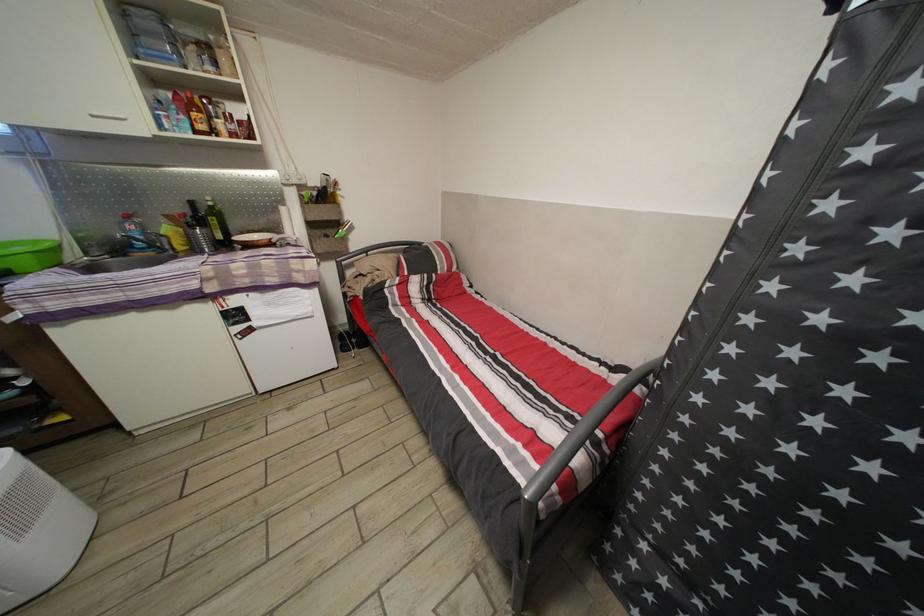
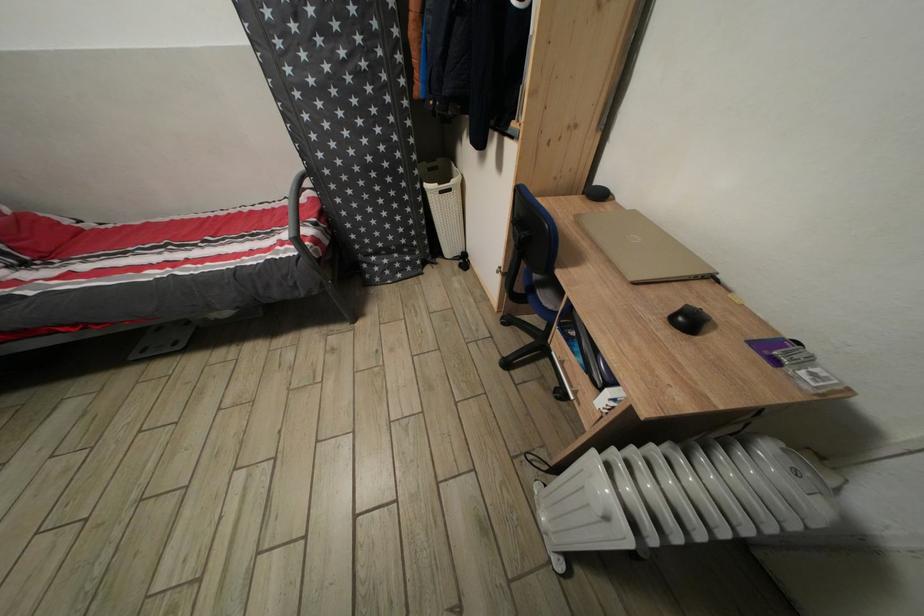
The point at (x=710, y=475) is marked in the first image. Where is the corresponding point in the second image?

(357, 198)